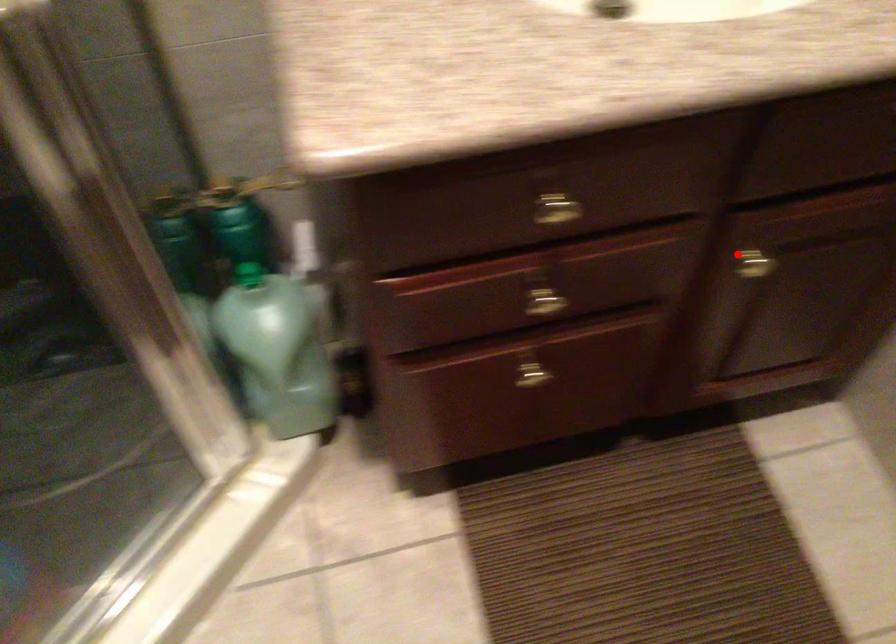
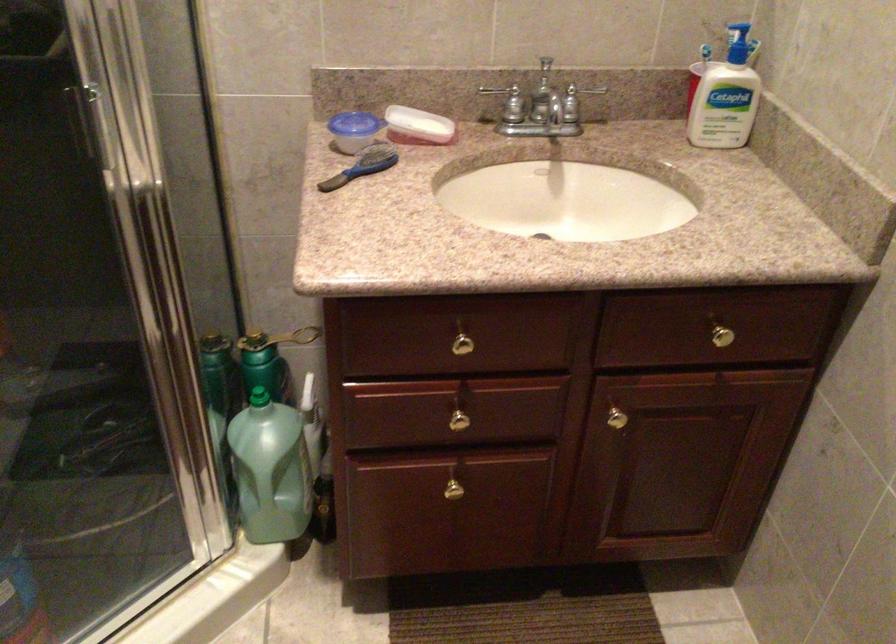
Locate, in the second image, the point that corresponds to the highlighted location in the first image.

(612, 411)